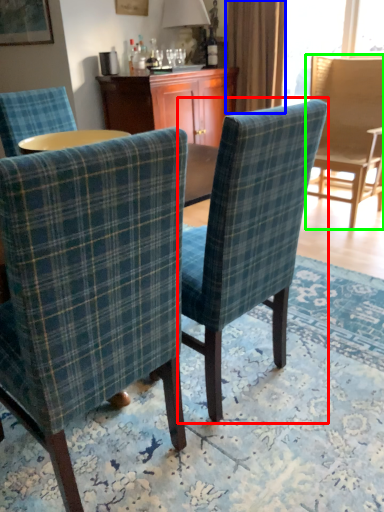
Question: Estimate the real-world distances between objects in this image. Which object is farther from chair (highlighted by a red box), curtain (highlighted by a blue box) or chair (highlighted by a green box)?

Choices:
 (A) curtain
 (B) chair

Answer: (A)